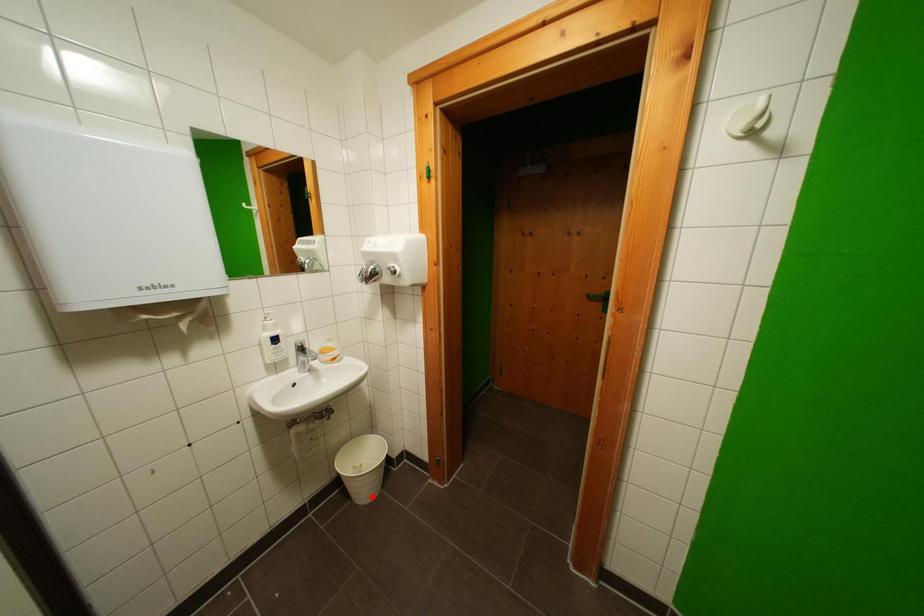
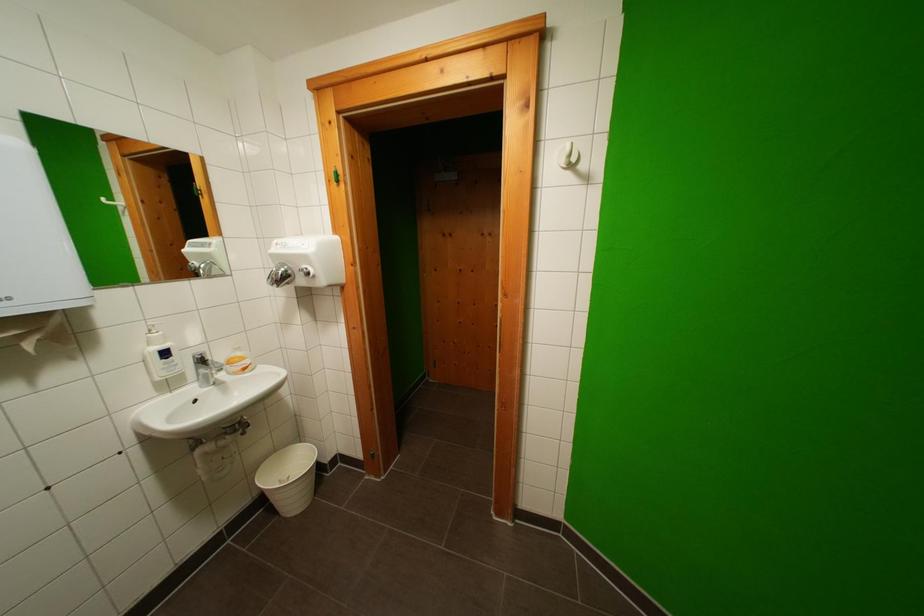
Question: I am providing you with two images of the same scene from different viewpoints. Image1 has a red point marked. In image2, the corresponding 3D location appears at what relative position? Reply with the corresponding letter.

Choices:
 (A) Closer
 (B) Farther

Answer: (A)